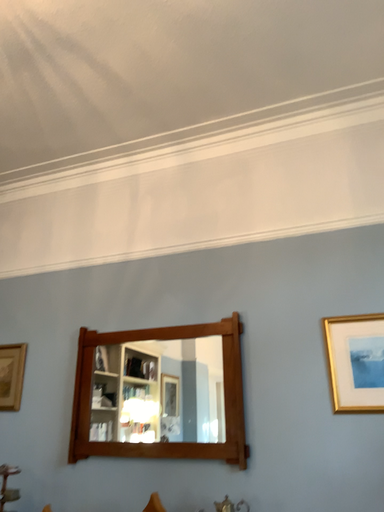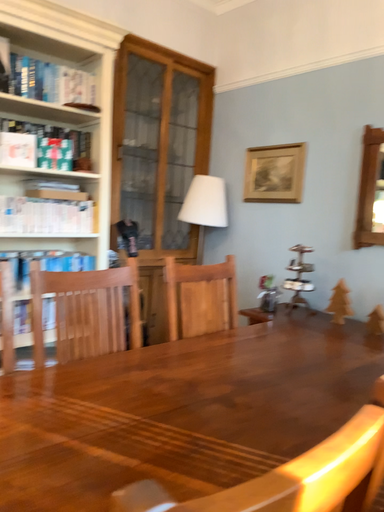
Question: Which way did the camera rotate in the video?

Choices:
 (A) rotated right
 (B) rotated left

Answer: (B)